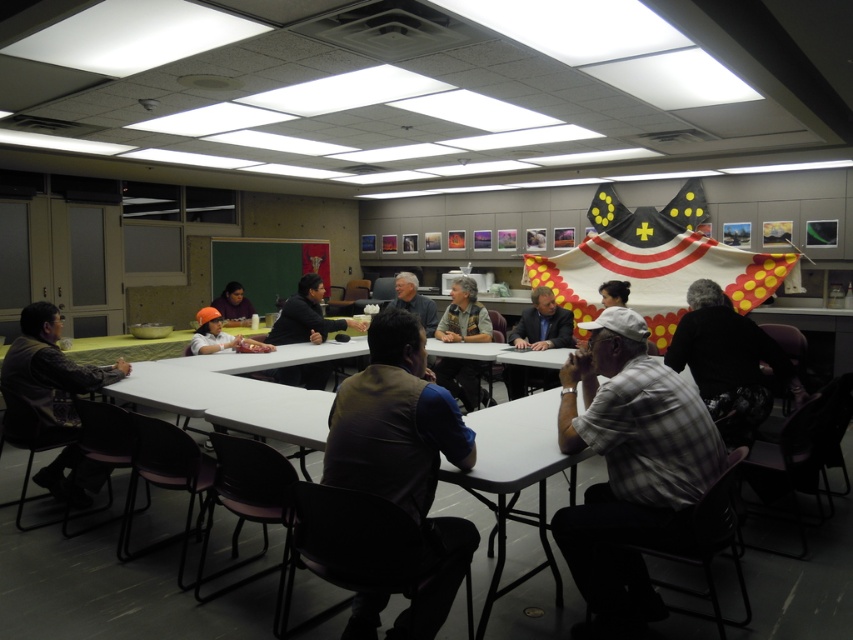
Based on the photo, which is below, camouflage vest at center or matte gray shirt at center?

Positioned lower is matte gray shirt at center.

Is camouflage vest at center shorter than matte gray shirt at center?

In fact, camouflage vest at center may be taller than matte gray shirt at center.

Locate an element on the screen. camouflage vest at center is located at coordinates [x=463, y=316].

Which is in front, point (42, 384) or point (405, 291)?

Point (42, 384) is more forward.

Which is more to the right, camouflage jacket at left or gray fabric vest at center?

gray fabric vest at center is more to the right.

Between point (27, 385) and point (428, 308), which one is positioned behind?

Point (428, 308)

Find the location of `camouflage jacket at left`. camouflage jacket at left is located at coordinates (50, 369).

Who is more distant from viewer, (x=755, y=397) or (x=221, y=296)?

Positioned behind is point (x=221, y=296).

Between point (704, 333) and point (224, 301), which one is positioned in front?

Point (704, 333) is more forward.

Is point (767, 392) closer to viewer compared to point (228, 305)?

That is True.

Image resolution: width=853 pixels, height=640 pixels. Identify the location of plaid shirt at center. (728, 362).